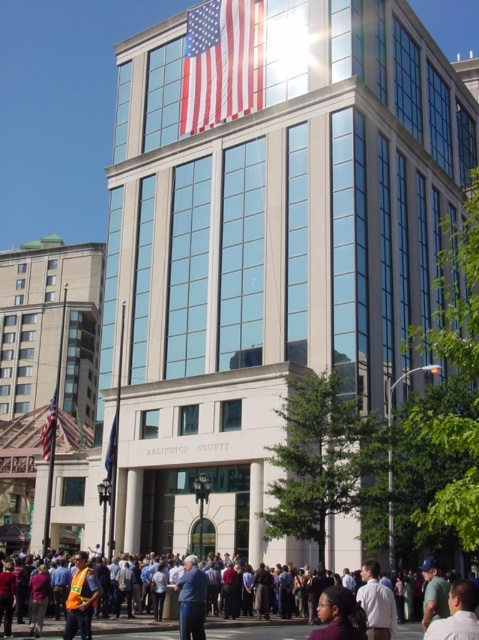
Question: Considering the relative positions of blue fabric shirt at center and red fabric flag at left in the image provided, where is blue fabric shirt at center located with respect to red fabric flag at left?

Choices:
 (A) below
 (B) above

Answer: (A)

Question: Observing the image, what is the correct spatial positioning of red fabric flag at left in reference to blue fabric flag at center?

Choices:
 (A) below
 (B) above

Answer: (A)

Question: Which object is farther from the camera taking this photo?

Choices:
 (A) white shirt at center
 (B) blue fabric shirt at center

Answer: (B)

Question: Estimate the real-world distances between objects in this image. Which object is farther from the american flag at upper center?

Choices:
 (A) red fabric flag at left
 (B) reflective orange vest at lower left
 (C) white shirt at center
 (D) orange safety vest at lower left

Answer: (C)

Question: Does dark brown hair at lower center come in front of light brown hair at lower right?

Choices:
 (A) yes
 (B) no

Answer: (B)

Question: Which point is closer to the camera taking this photo?

Choices:
 (A) (109, 436)
 (B) (444, 628)
 (C) (198, 602)

Answer: (B)